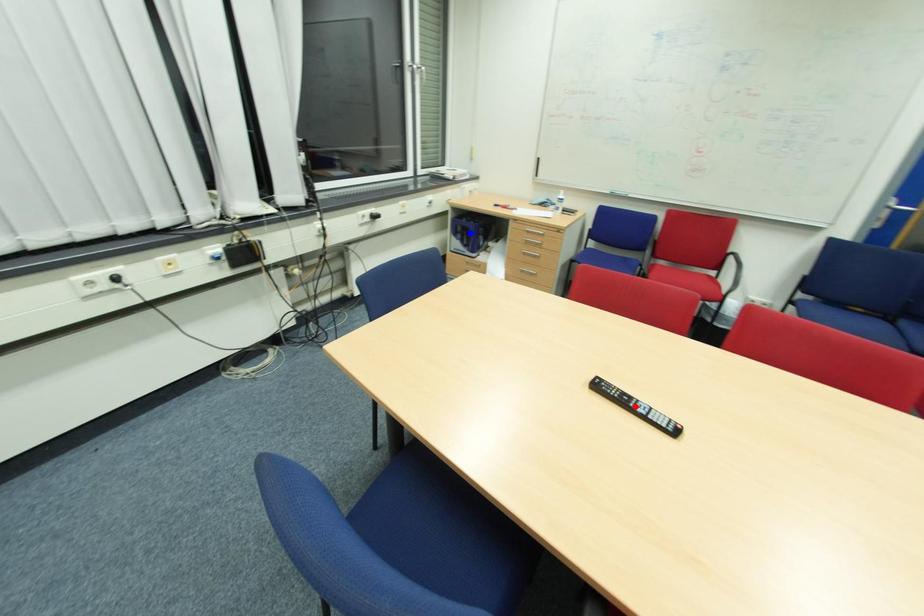
Question: Two points are marked on the image. Which point is closer to the camera?

Choices:
 (A) Blue point is closer.
 (B) Red point is closer.

Answer: (B)